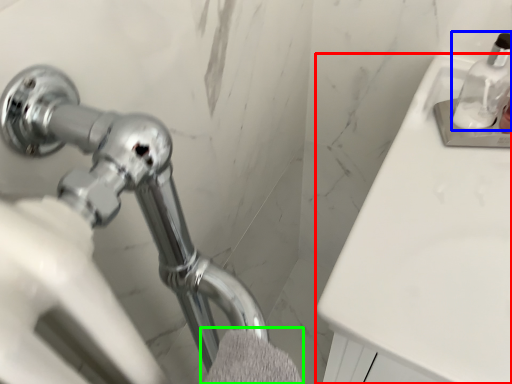
Question: Estimate the real-world distances between objects in this image. Which object is closer to counter top (highlighted by a red box), soap dispenser (highlighted by a blue box) or bath towel (highlighted by a green box)?

Choices:
 (A) soap dispenser
 (B) bath towel

Answer: (A)